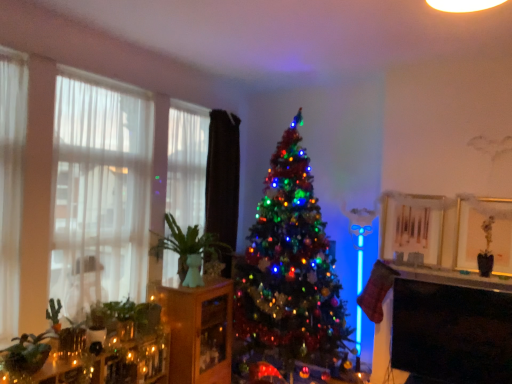
This screenshot has height=384, width=512. In order to click on white sheer curtain at left, which appears as the 2th curtain when viewed from the right in this screenshot , I will do `click(187, 163)`.

Identify the location of green matte plant at lower left. (134, 315).

Locate an element on the screen. Image resolution: width=512 pixels, height=384 pixels. iridescent glass christmas tree at center is located at coordinates (290, 268).

Where is `white sheer curtain at left, acting as the first curtain starting from the left`? This screenshot has width=512, height=384. white sheer curtain at left, acting as the first curtain starting from the left is located at coordinates (187, 163).

Considering the sizes of objects green matte plant at lower left and matte glass candle at lower left in the image provided, who is bigger, green matte plant at lower left or matte glass candle at lower left?

With larger size is matte glass candle at lower left.

In the scene shown: Considering the relative sizes of green matte plant at lower left and matte glass candle at lower left in the image provided, is green matte plant at lower left thinner than matte glass candle at lower left?

Incorrect, the width of green matte plant at lower left is not less than that of matte glass candle at lower left.

Considering the points (106, 311) and (96, 309), which point is behind, point (106, 311) or point (96, 309)?

The point (96, 309) is farther from the camera.

From the image's perspective, is green matte plant at lower left positioned above or below matte glass candle at lower left?

From the image's perspective, green matte plant at lower left appears above matte glass candle at lower left.

Are green matte plant at lower left and iridescent glass christmas tree at center beside each other?

green matte plant at lower left and iridescent glass christmas tree at center are not in contact.

Does green matte plant at lower left have a greater height compared to iridescent glass christmas tree at center?

In fact, green matte plant at lower left may be shorter than iridescent glass christmas tree at center.

Which is closer, (131, 313) or (259, 240)?

Point (131, 313).

Considering the sizes of green matte plant at lower left and iridescent glass christmas tree at center in the image, is green matte plant at lower left wider or thinner than iridescent glass christmas tree at center?

In the image, green matte plant at lower left appears to be more narrow than iridescent glass christmas tree at center.

Where is `plant below the white sheer curtain at left, acting as the first curtain starting from the left (from a real-world perspective)`? plant below the white sheer curtain at left, acting as the first curtain starting from the left (from a real-world perspective) is located at coordinates (134, 315).

In terms of size, does green matte plant at lower left appear bigger or smaller than white sheer curtain at left, acting as the first curtain starting from the left?

In the image, green matte plant at lower left appears to be smaller than white sheer curtain at left, acting as the first curtain starting from the left.

Is green matte plant at lower left facing away from white sheer curtain at left, which appears as the 2th curtain when viewed from the right?

No, green matte plant at lower left is not facing away from white sheer curtain at left, which appears as the 2th curtain when viewed from the right.

Based on their positions, is green matte plant at lower left located to the left or right of white sheer curtain at left, acting as the first curtain starting from the left?

green matte plant at lower left is positioned on white sheer curtain at left, acting as the first curtain starting from the left,'s left side.

Is matte glass candle at lower left wider or thinner than wooden cabinet at center?

Clearly, matte glass candle at lower left has less width compared to wooden cabinet at center.

From a real-world perspective, between matte glass candle at lower left and wooden cabinet at center, who is vertically higher?

From a 3D spatial view, matte glass candle at lower left is above.

Is the surface of matte glass candle at lower left in direct contact with wooden cabinet at center?

No.

At what (x,y) coordinates should I click in order to perform the action: click on shelf that appears on the right of matte glass candle at lower left. Please return your answer as a coordinate pair (x, y). Looking at the image, I should click on (199, 332).

In terms of size, does wooden cabinet at center appear bigger or smaller than green ceramic vase at left?

In the image, wooden cabinet at center appears to be larger than green ceramic vase at left.

Between wooden cabinet at center and green ceramic vase at left, which one is positioned behind?

wooden cabinet at center is behind.

Measure the distance from wooden cabinet at center to green ceramic vase at left.

The distance of wooden cabinet at center from green ceramic vase at left is 15.06 inches.

Identify the location of houseplant above the wooden cabinet at center (from a real-world perspective). The height and width of the screenshot is (384, 512). (189, 249).

Considering the relative sizes of green matte plant at lower left and wooden cabinet at center in the image provided, is green matte plant at lower left shorter than wooden cabinet at center?

Correct, green matte plant at lower left is not as tall as wooden cabinet at center.

In the image, there is a green matte plant at lower left. Where is `shelf below it (from a real-world perspective)`? shelf below it (from a real-world perspective) is located at coordinates (199, 332).

Considering the sizes of objects green matte plant at lower left and wooden cabinet at center in the image provided, who is smaller, green matte plant at lower left or wooden cabinet at center?

Smaller between the two is green matte plant at lower left.

What's the angular difference between green matte plant at lower left and wooden cabinet at center's facing directions?

green matte plant at lower left and wooden cabinet at center are facing 2.54 degrees away from each other.

Between white sheer curtain at left, which appears as the 2th curtain when viewed from the right, and black glossy tv at lower right, which one is positioned in front?

black glossy tv at lower right is more forward.

Which of these two, white sheer curtain at left, acting as the first curtain starting from the left, or black glossy tv at lower right, stands taller?

Standing taller between the two is white sheer curtain at left, acting as the first curtain starting from the left.

From the image's perspective, is white sheer curtain at left, which appears as the 2th curtain when viewed from the right, below black glossy tv at lower right?

No, from the image's perspective, white sheer curtain at left, which appears as the 2th curtain when viewed from the right, is not below black glossy tv at lower right.

Considering the relative sizes of white sheer curtain at left, acting as the first curtain starting from the left, and black glossy tv at lower right in the image provided, is white sheer curtain at left, acting as the first curtain starting from the left, bigger than black glossy tv at lower right?

Yes, white sheer curtain at left, acting as the first curtain starting from the left, is bigger than black glossy tv at lower right.

In the image, there is a matte glass candle at lower left. Find the location of `plant above it (from the image's perspective)`. plant above it (from the image's perspective) is located at coordinates (134, 315).

You are a GUI agent. You are given a task and a screenshot of the screen. Output one action in this format:
    pyautogui.click(x=<x>, y=<y>)
    Task: Click on the christmas tree that is on the right side of green matte plant at lower left
    The width and height of the screenshot is (512, 384).
    Given the screenshot: What is the action you would take?
    pyautogui.click(x=290, y=268)

Based on their spatial positions, is black glossy tv at lower right or white sheer curtain at left, which appears as the 2th curtain when viewed from the right, closer to translucent fabric at left?

Among the two, white sheer curtain at left, which appears as the 2th curtain when viewed from the right, is located nearer to translucent fabric at left.

Which object lies nearer to the anchor point matte white shelf at lower right, wooden cabinet at center or green ceramic vase at left?

wooden cabinet at center is closer to matte white shelf at lower right.

Looking at the image, which one is located further to translucent fabric at left, matte glass candle at lower left or green ceramic vase at left?

matte glass candle at lower left is positioned further to the anchor translucent fabric at left.

In the scene shown: Looking at the image, which one is located closer to black glossy tv at lower right, wooden cabinet at center or white sheer curtain at left, which appears as the 2th curtain when viewed from the right?

wooden cabinet at center.

Estimate the real-world distances between objects in this image. Which object is further from translucent fabric at left, white sheer curtain at left, which appears as the 2th curtain when viewed from the right, or green matte plant at lower left?

Among the two, green matte plant at lower left is located further to translucent fabric at left.

Based on their spatial positions, is green matte plant at lower left or matte glass candle at lower left further from black velvet curtain at center, the 2th curtain viewed from the left?

Among the two, matte glass candle at lower left is located further to black velvet curtain at center, the 2th curtain viewed from the left.

Considering their positions, is translucent fabric at left positioned further to black glossy tv at lower right than green matte plant at lower left?

translucent fabric at left.

Based on their spatial positions, is translucent fabric at left or white sheer curtain at left, acting as the first curtain starting from the left, further from green matte plant at lower left?

The object further to green matte plant at lower left is white sheer curtain at left, acting as the first curtain starting from the left.

You are a GUI agent. You are given a task and a screenshot of the screen. Output one action in this format:
    pyautogui.click(x=<x>, y=<y>)
    Task: Click on the plant between black velvet curtain at center, the 2th curtain viewed from the left, and wooden cabinet at center from top to bottom
    This screenshot has height=384, width=512.
    Given the screenshot: What is the action you would take?
    pyautogui.click(x=134, y=315)

This screenshot has height=384, width=512. What are the coordinates of `plant located between matte glass candle at lower left and wooden cabinet at center in the depth direction` in the screenshot? It's located at pos(134,315).

The image size is (512, 384). In order to click on houseplant situated between matte glass candle at lower left and matte white shelf at lower right from left to right in this screenshot , I will do `click(189, 249)`.

Locate an element on the screen. The width and height of the screenshot is (512, 384). plant positioned between matte glass candle at lower left and white sheer curtain at left, acting as the first curtain starting from the left, from near to far is located at coordinates (134, 315).